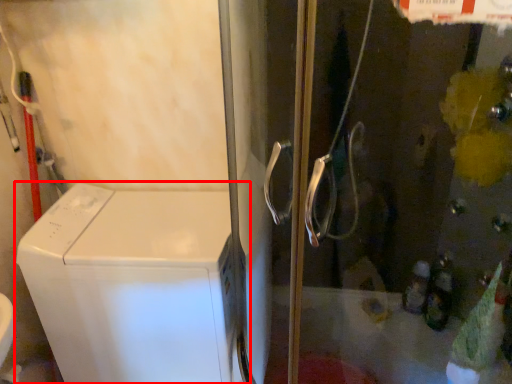
Question: From the image, what is the correct spatial relationship of home appliance (annotated by the red box) in relation to screen door?

Choices:
 (A) right
 (B) left

Answer: (B)